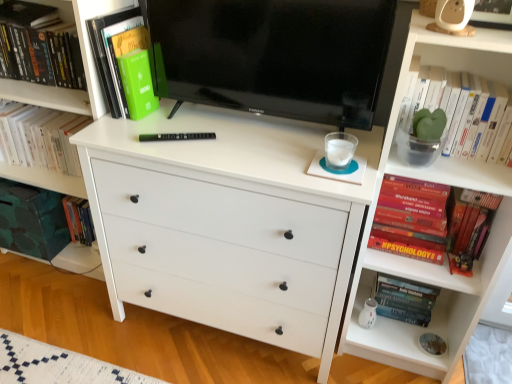
I want to click on free point below black glossy tv at center (from a real-world perspective), so click(x=254, y=126).